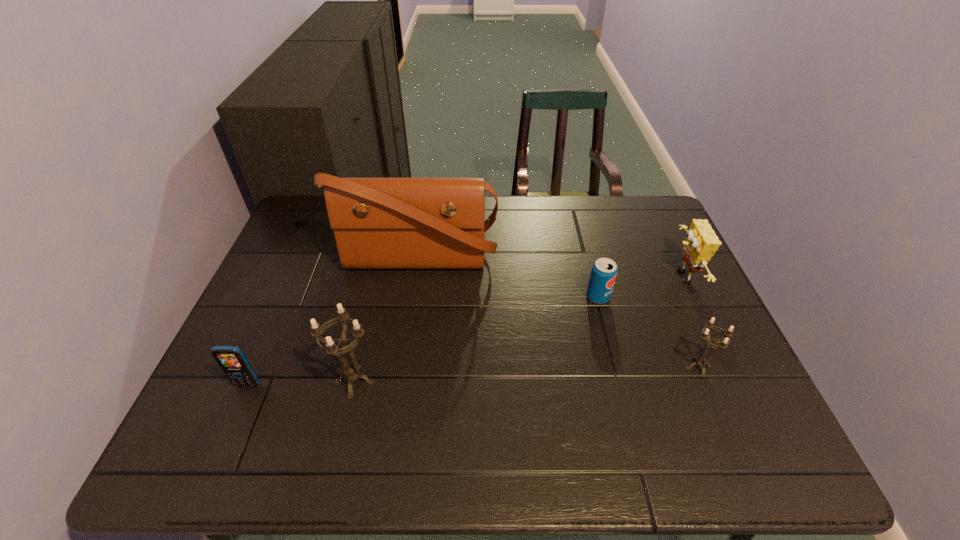
Where is `sponge at the right edge`? The image size is (960, 540). sponge at the right edge is located at coordinates (701, 243).

Find the location of a particular element. object at the near left corner is located at coordinates (231, 359).

The image size is (960, 540). In the image, there is a desktop. What are the coordinates of `vacant space at the far edge` in the screenshot? It's located at (611, 230).

This screenshot has width=960, height=540. Find the location of `blank area at the near edge`. blank area at the near edge is located at coordinates (568, 385).

Where is `vacant space at the left edge of the desktop`? The image size is (960, 540). vacant space at the left edge of the desktop is located at coordinates pos(255,300).

In the image, there is a desktop. At what (x,y) coordinates should I click in order to perform the action: click on free space at the right edge. Please return your answer as a coordinate pair (x, y). Image resolution: width=960 pixels, height=540 pixels. Looking at the image, I should click on (640, 245).

Where is `blank space at the far left corner of the desktop`? The width and height of the screenshot is (960, 540). blank space at the far left corner of the desktop is located at coordinates (302, 202).

I want to click on free space at the far right corner of the desktop, so click(649, 205).

The image size is (960, 540). In order to click on empty space between the second tallest object and the sponge in this screenshot , I will do `click(517, 329)`.

Image resolution: width=960 pixels, height=540 pixels. In order to click on vacant area that lies between the cellular telephone and the satchel in this screenshot , I will do [x=333, y=322].